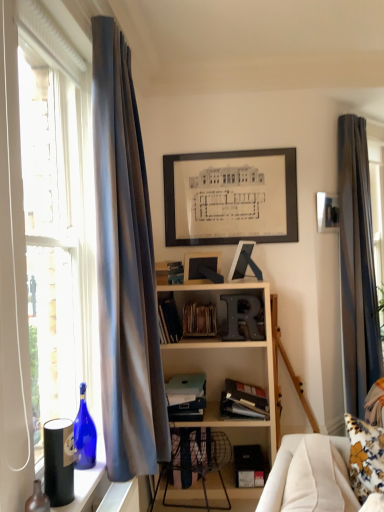
Image resolution: width=384 pixels, height=512 pixels. I want to click on vacant space situated above matte black book at center, the fifth book positioned from the top (from a real-world perspective), so click(x=183, y=383).